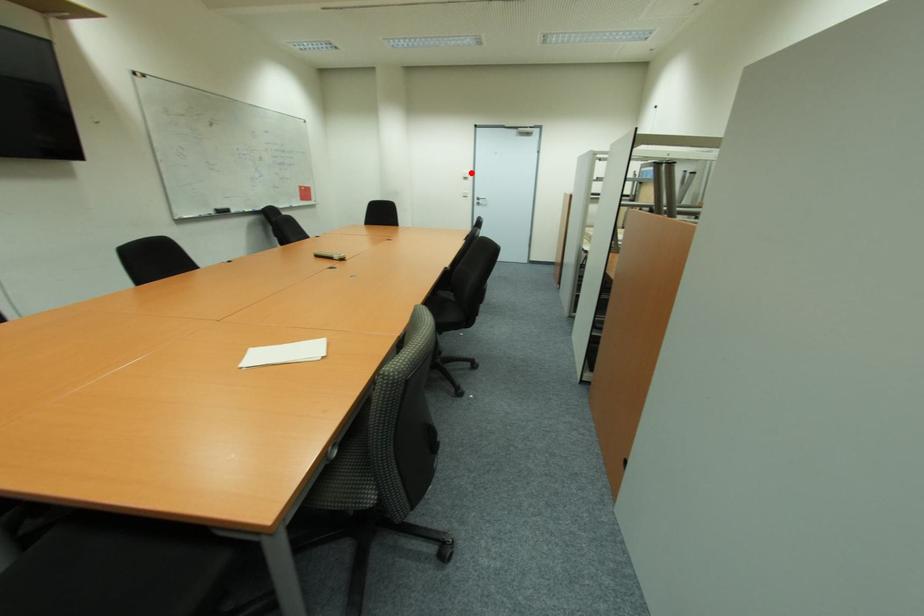
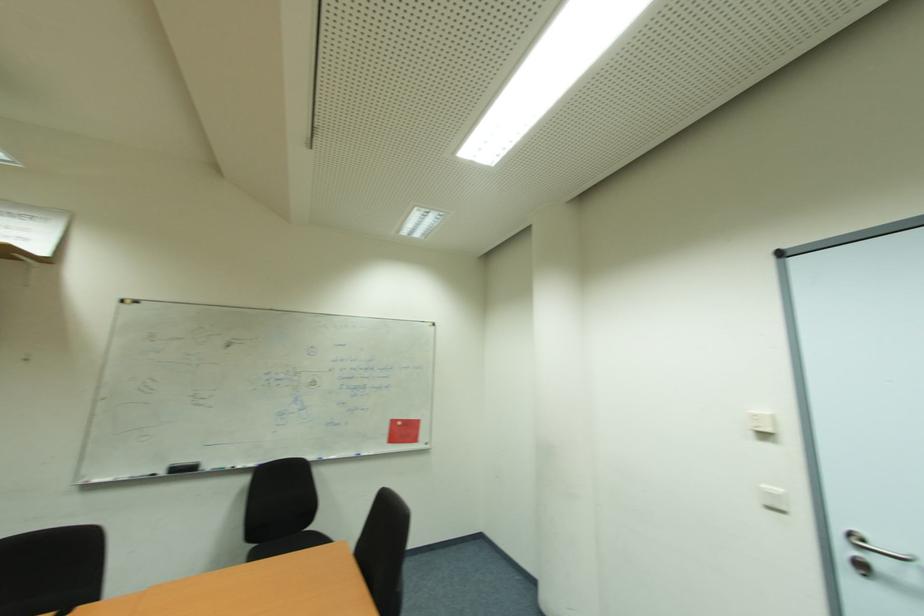
Find the pixel in the second image that matches the highlighted location in the first image.

(771, 414)